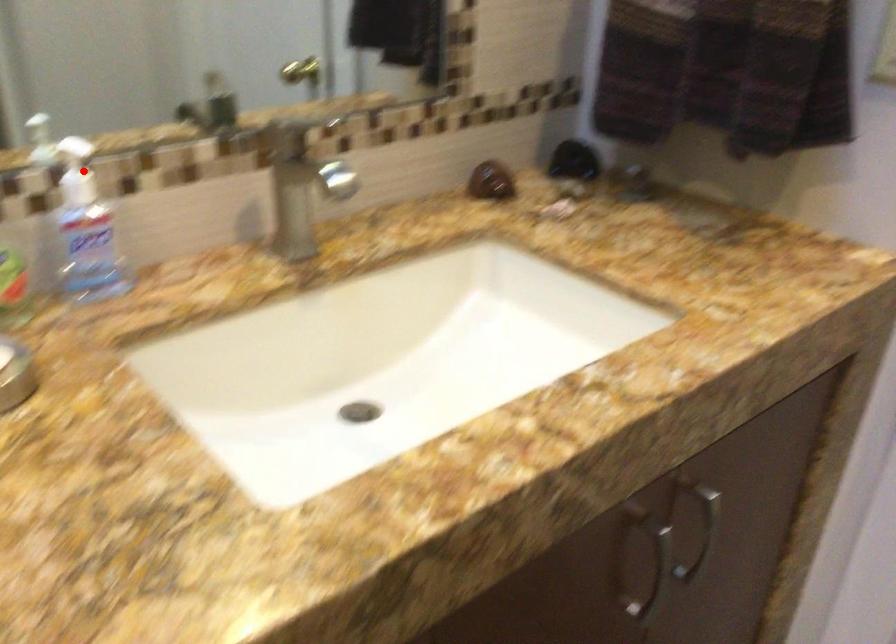
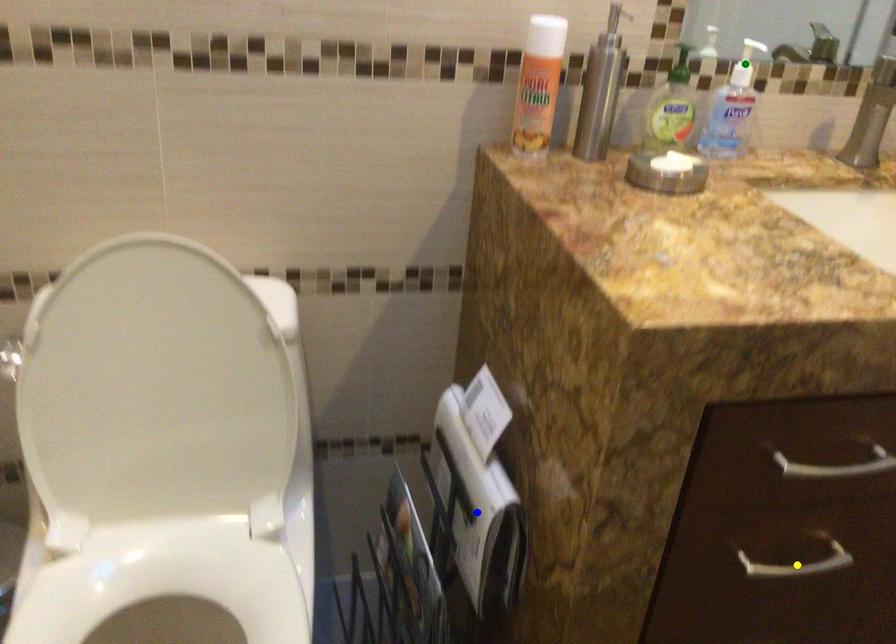
Question: I am providing you with two images of the same scene from different viewpoints. A red point is marked on the first image. You are given multiple points on the second image. Which mark in image 2 goes with the point in image 1?

Choices:
 (A) yellow point
 (B) blue point
 (C) green point

Answer: (C)